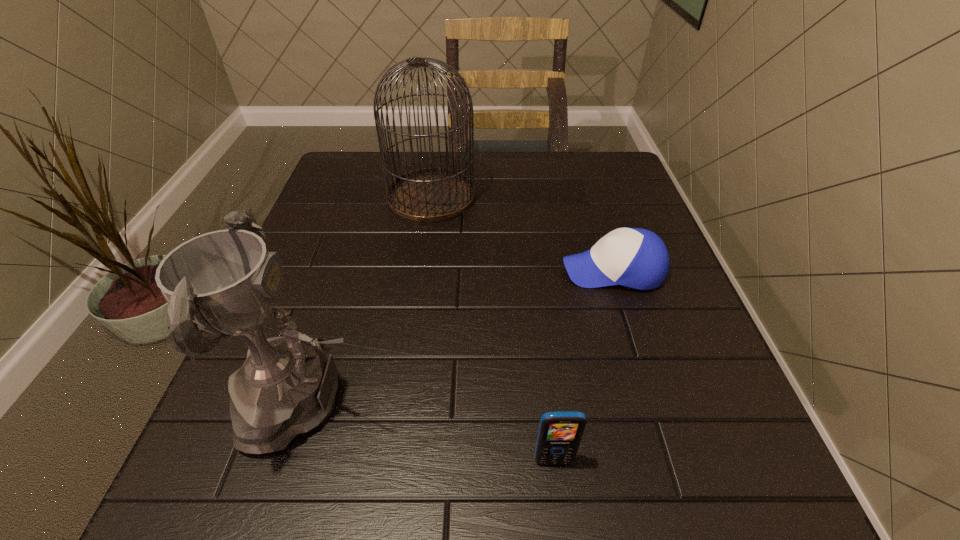
I want to click on vacant space at the left edge of the desktop, so click(x=311, y=292).

Find the location of a particular element. This screenshot has width=960, height=540. vacant space at the right edge of the desktop is located at coordinates (658, 342).

The width and height of the screenshot is (960, 540). In order to click on vacant space at the far left corner of the desktop in this screenshot , I will do `click(374, 173)`.

Where is `vacant space at the far right corner of the desktop`? This screenshot has width=960, height=540. vacant space at the far right corner of the desktop is located at coordinates (588, 153).

The height and width of the screenshot is (540, 960). In order to click on vacant space that is in between the award and the rightmost object in this screenshot , I will do 461,336.

Locate an element on the screen. The width and height of the screenshot is (960, 540). vacant space in between the baseball cap and the award is located at coordinates (461, 336).

Locate an element on the screen. The height and width of the screenshot is (540, 960). free space between the farthest object and the cellular telephone is located at coordinates (492, 328).

You are a GUI agent. You are given a task and a screenshot of the screen. Output one action in this format:
    pyautogui.click(x=<x>, y=<y>)
    Task: Click on the free area in between the award and the shortest object
    The width and height of the screenshot is (960, 540).
    Given the screenshot: What is the action you would take?
    pyautogui.click(x=461, y=336)

This screenshot has width=960, height=540. I want to click on free area in between the rightmost object and the award, so click(x=461, y=336).

Locate an element on the screen. This screenshot has width=960, height=540. free space between the second farthest object and the third object from left to right is located at coordinates pos(583,365).